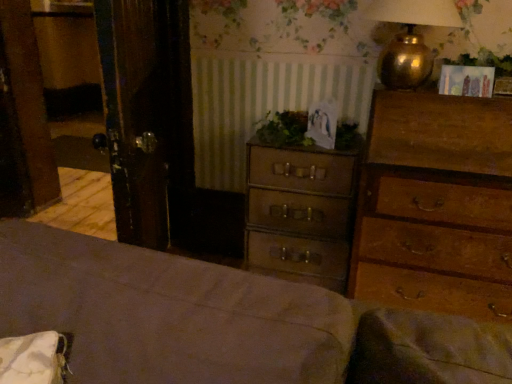
Question: From a real-world perspective, is wooden chest of drawers at right, which is counted as the 1th chest of drawers, starting from the right, above or below brown leather suitcase at center, which ranks as the first chest of drawers in left-to-right order?

Choices:
 (A) below
 (B) above

Answer: (A)

Question: Would you say wooden chest of drawers at right, which is counted as the 1th chest of drawers, starting from the right, is to the left or to the right of brown leather suitcase at center, which ranks as the first chest of drawers in left-to-right order, in the picture?

Choices:
 (A) left
 (B) right

Answer: (B)

Question: Which of these objects is positioned closest to the gold metallic lamp at upper right?

Choices:
 (A) green leafy plant at center, positioned as the second plant in top-to-bottom order
 (B) brown leather suitcase at center, the second chest of drawers from the right
 (C) brown wooden bed frame at lower left
 (D) green leafy plant at upper right, the first plant from the right
 (E) wooden chest of drawers at right, which is the 2th chest of drawers from left to right

Answer: (D)

Question: Based on their relative distances, which object is nearer to the wooden chest of drawers at right, which is the 2th chest of drawers from left to right?

Choices:
 (A) green leafy plant at upper right, marked as the 2th plant in a left-to-right arrangement
 (B) green leafy plant at center, positioned as the 1th plant in bottom-to-top order
 (C) brown leather suitcase at center, the second chest of drawers from the right
 (D) wooden picture frame at upper right
 (E) gold metallic lamp at upper right

Answer: (C)